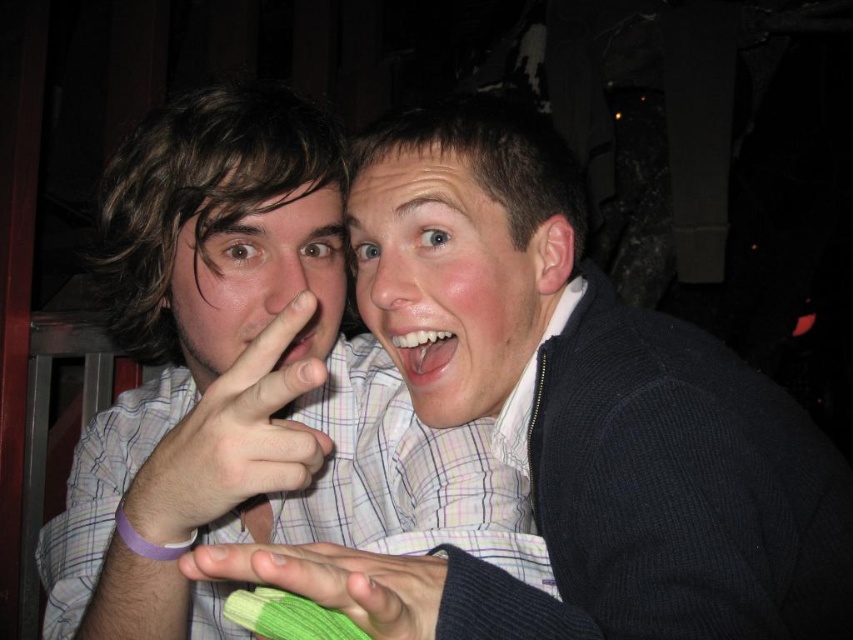
What is located at the point with coordinates (337, 580) in the image?

The green knitted glove at center is located at the point with coordinates (337, 580) in the image.

You are a photographer taking a picture of two people standing side by side. You notice a white matte hand at center and a green knitted glove at center in your frame. Which object is taller in the image?

The white matte hand at center is taller than the green knitted glove at center.

You are a photographer adjusting the focus of your camera. The green knitted glove at center and the white glossy teeth at center are both in your frame. If your camera has a depth of field that can only clearly focus on objects within a 10 inch range, will both objects remain in focus?

The distance between the green knitted glove at center and the white glossy teeth at center is 10.83 inches, which exceeds the 10 inch range. Therefore, both objects cannot be in focus simultaneously.